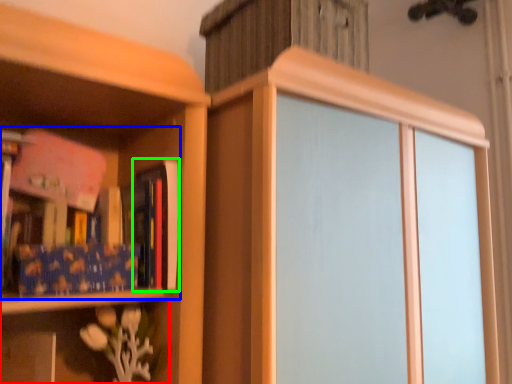
Question: Based on their relative distances, which object is nearer to shelf (highlighted by a red box)? Choose from book (highlighted by a blue box) and book (highlighted by a green box).

Choices:
 (A) book
 (B) book

Answer: (A)